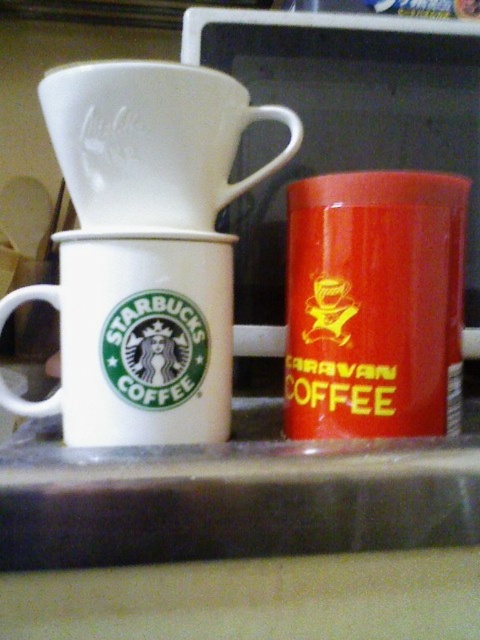
You are holding a ruler and want to measure the distance between the Starbucks Coffee Mug on the left and the matte red coffee canister at right. According to the image, how far apart are they?

The matte red coffee canister at right is 18.97 inches away from camera, so the distance between the Starbucks Coffee Mug on the left and the matte red coffee canister at right cannot be determined without knowing the distance of the Starbucks Coffee Mug from the camera.

You are organizing a coffee station and need to place the matte red coffee canister at right and the white matte coffee filter at upper center. According to the image, which object is positioned to the right of the other?

The matte red coffee canister at right is to the right of the white matte coffee filter at upper center.